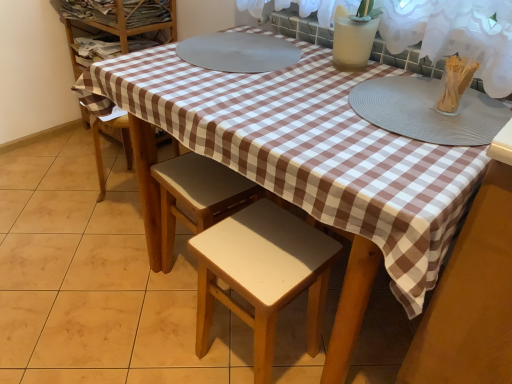
Question: Is clear plastic container at upper right to the right of white matte glass vase at upper right from the viewer's perspective?

Choices:
 (A) yes
 (B) no

Answer: (A)

Question: From the image's perspective, is clear plastic container at upper right on top of white matte glass vase at upper right?

Choices:
 (A) no
 (B) yes

Answer: (A)

Question: Is clear plastic container at upper right further to camera compared to white matte glass vase at upper right?

Choices:
 (A) no
 (B) yes

Answer: (A)

Question: Is clear plastic container at upper right oriented away from white matte glass vase at upper right?

Choices:
 (A) yes
 (B) no

Answer: (B)

Question: Is clear plastic container at upper right smaller than white matte glass vase at upper right?

Choices:
 (A) no
 (B) yes

Answer: (B)

Question: Is clear plastic container at upper right bigger than white matte glass vase at upper right?

Choices:
 (A) yes
 (B) no

Answer: (B)

Question: Does clear plastic container at upper right have a lesser width compared to gray textured placemat at upper right?

Choices:
 (A) no
 (B) yes

Answer: (B)

Question: Does clear plastic container at upper right have a greater height compared to gray textured placemat at upper right?

Choices:
 (A) yes
 (B) no

Answer: (A)

Question: Is clear plastic container at upper right shorter than gray textured placemat at upper right?

Choices:
 (A) no
 (B) yes

Answer: (A)

Question: From the image's perspective, does clear plastic container at upper right appear lower than gray textured placemat at upper right?

Choices:
 (A) yes
 (B) no

Answer: (B)

Question: Is clear plastic container at upper right located outside gray textured placemat at upper right?

Choices:
 (A) yes
 (B) no

Answer: (A)

Question: From the image's perspective, is clear plastic container at upper right on gray textured placemat at upper right?

Choices:
 (A) yes
 (B) no

Answer: (A)

Question: Is gray textured placemat at upper right shorter than white matte glass vase at upper right?

Choices:
 (A) no
 (B) yes

Answer: (B)